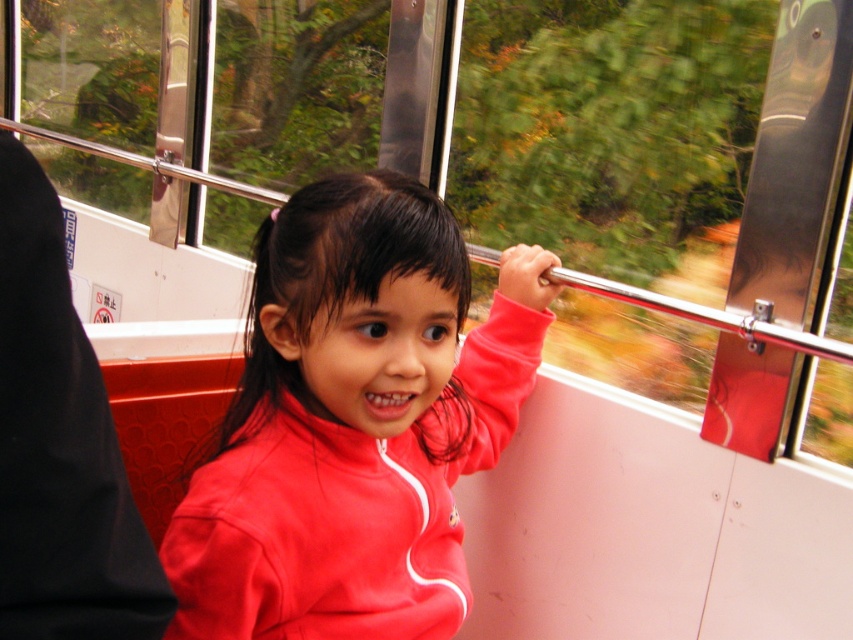
Is point (355, 637) less distant than point (32, 611)?

That is False.

Is point (376, 560) positioned after point (3, 480)?

Yes, it is.

This screenshot has width=853, height=640. Describe the element at coordinates (352, 422) in the screenshot. I see `matte red jacket at center` at that location.

This screenshot has width=853, height=640. Find the location of `matte red jacket at center`. matte red jacket at center is located at coordinates (352, 422).